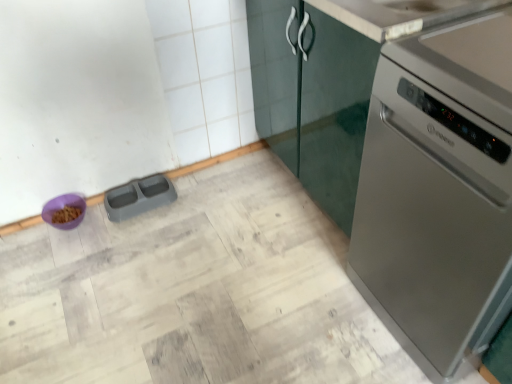
Question: Is the depth of satin silver dishwasher at right greater than that of purple plastic bowl at lower left, the 2th appliance viewed from the right?

Choices:
 (A) no
 (B) yes

Answer: (A)

Question: Is satin silver dishwasher at right facing away from purple plastic bowl at lower left, the 2th appliance viewed from the right?

Choices:
 (A) yes
 (B) no

Answer: (B)

Question: Is purple plastic bowl at lower left, the 2th appliance viewed from the right, completely or partially inside satin silver dishwasher at right?

Choices:
 (A) yes
 (B) no

Answer: (B)

Question: Is satin silver dishwasher at right with purple plastic bowl at lower left, the 2th appliance viewed from the right?

Choices:
 (A) yes
 (B) no

Answer: (B)

Question: From a real-world perspective, is satin silver dishwasher at right under purple plastic bowl at lower left, the 2th appliance viewed from the right?

Choices:
 (A) yes
 (B) no

Answer: (B)

Question: From their relative heights in the image, would you say purple plastic bowl at lower left, the 2th appliance viewed from the right, is taller or shorter than satin silver dishwasher at right?

Choices:
 (A) tall
 (B) short

Answer: (B)

Question: From a real-world perspective, is purple plastic bowl at lower left, the 2th appliance viewed from the right, positioned above or below satin silver dishwasher at right?

Choices:
 (A) below
 (B) above

Answer: (A)

Question: Relative to satin silver dishwasher at right, is purple plastic bowl at lower left, arranged as the 1th appliance when viewed from the left, in front or behind?

Choices:
 (A) front
 (B) behind

Answer: (B)

Question: From the image's perspective, relative to satin silver dishwasher at right, is purple plastic bowl at lower left, arranged as the 1th appliance when viewed from the left, above or below?

Choices:
 (A) below
 (B) above

Answer: (A)

Question: From a real-world perspective, relative to gray plastic pet feeder at lower left, which is the 1th appliance from right to left, is satin silver dishwasher at right vertically above or below?

Choices:
 (A) above
 (B) below

Answer: (A)

Question: From the image's perspective, relative to gray plastic pet feeder at lower left, the 2th appliance in the left-to-right sequence, is satin silver dishwasher at right above or below?

Choices:
 (A) above
 (B) below

Answer: (B)

Question: Is satin silver dishwasher at right in front of or behind gray plastic pet feeder at lower left, the 2th appliance in the left-to-right sequence, in the image?

Choices:
 (A) front
 (B) behind

Answer: (A)

Question: Is point (403, 327) positioned closer to the camera than point (138, 210)?

Choices:
 (A) farther
 (B) closer

Answer: (B)

Question: Considering their positions, is gray plastic pet feeder at lower left, which is the 1th appliance from right to left, located in front of or behind satin silver dishwasher at right?

Choices:
 (A) behind
 (B) front

Answer: (A)

Question: Which is correct: gray plastic pet feeder at lower left, the 2th appliance in the left-to-right sequence, is inside satin silver dishwasher at right, or outside of it?

Choices:
 (A) outside
 (B) inside

Answer: (A)